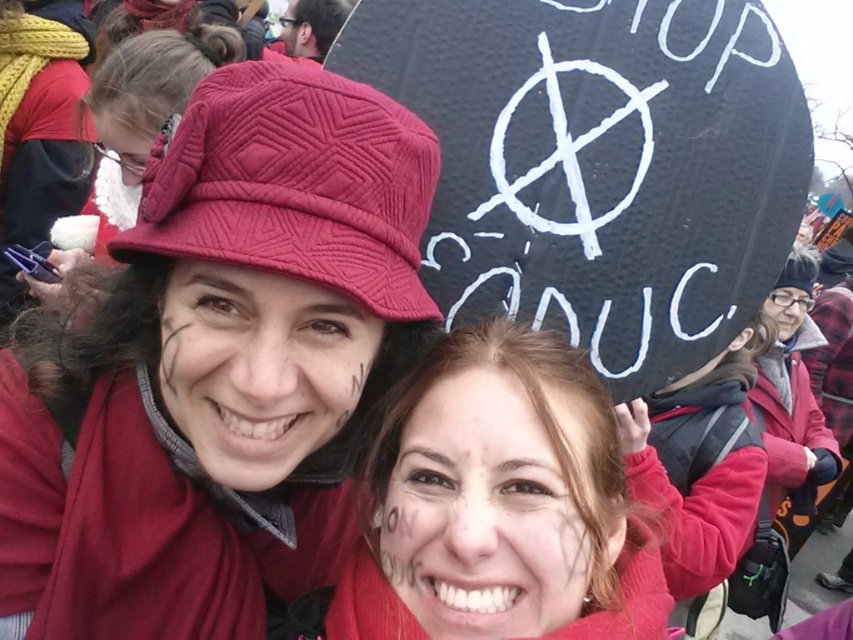
Consider the image. Is matte red hat at upper left positioned in front of matte red scarf at center?

Yes, matte red hat at upper left is closer to the viewer.

Which of these two, matte red hat at upper left or matte red scarf at center, stands shorter?

matte red scarf at center

This screenshot has height=640, width=853. Describe the element at coordinates (218, 365) in the screenshot. I see `matte red hat at upper left` at that location.

Where is `matte red hat at upper left`? The image size is (853, 640). matte red hat at upper left is located at coordinates 218,365.

Is matte red hat at upper left wider than quilted fabric hat at upper center?

Yes, matte red hat at upper left is wider than quilted fabric hat at upper center.

Between matte red hat at upper left and quilted fabric hat at upper center, which one appears on the right side from the viewer's perspective?

Positioned to the right is matte red hat at upper left.

Does point (271, 291) lie in front of point (119, 83)?

Yes, it is.

Identify the location of matte red hat at upper left. (218, 365).

Which is more to the right, black cardboard sign at upper center or matte red scarf at center?

black cardboard sign at upper center is more to the right.

In the scene shown: Does black cardboard sign at upper center lie in front of matte red scarf at center?

No, it is not.

Image resolution: width=853 pixels, height=640 pixels. Describe the element at coordinates (599, 164) in the screenshot. I see `black cardboard sign at upper center` at that location.

You are a GUI agent. You are given a task and a screenshot of the screen. Output one action in this format:
    pyautogui.click(x=<x>, y=<y>)
    Task: Click on the black cardboard sign at upper center
    
    Given the screenshot: What is the action you would take?
    pyautogui.click(x=599, y=164)